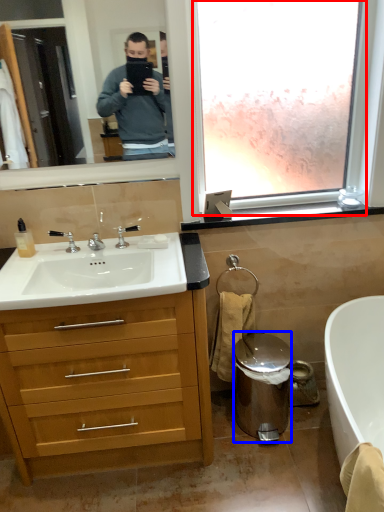
Question: Which of the following is the closest to the observer, window frame (highlighted by a red box) or trash bin/can (highlighted by a blue box)?

Choices:
 (A) window frame
 (B) trash bin/can

Answer: (A)